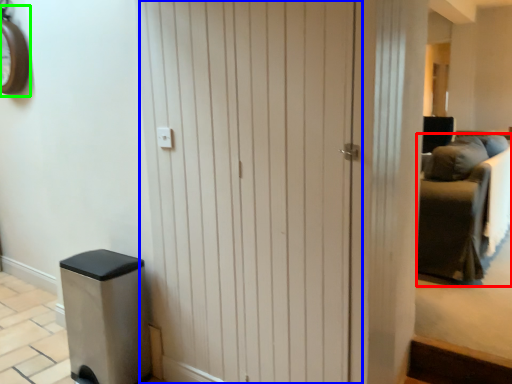
Question: Which object is the farthest from furniture (highlighted by a red box)? Choose among these: barn door (highlighted by a blue box) or clock (highlighted by a green box).

Choices:
 (A) barn door
 (B) clock

Answer: (B)